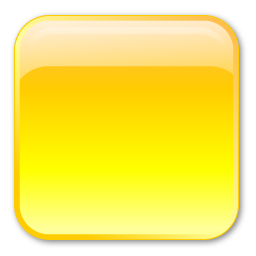
You are a GUI agent. You are given a task and a screenshot of the screen. Output one action in this format:
    pyautogui.click(x=<x>, y=<y>)
    Task: Click on the divider
    
    Given the screenshot: What is the action you would take?
    pyautogui.click(x=121, y=66)